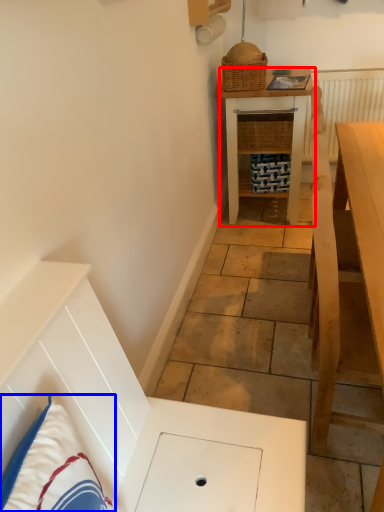
Question: Which object is further to the camera taking this photo, table (highlighted by a red box) or pillow (highlighted by a blue box)?

Choices:
 (A) table
 (B) pillow

Answer: (A)